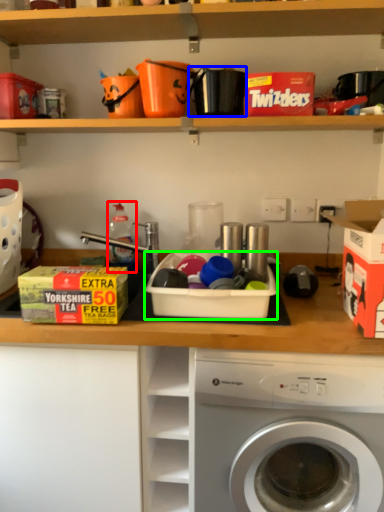
Question: Which object is the closest to the bottle (highlighted by a red box)? Choose among these: appliance (highlighted by a blue box) or storage box (highlighted by a green box).

Choices:
 (A) appliance
 (B) storage box

Answer: (B)